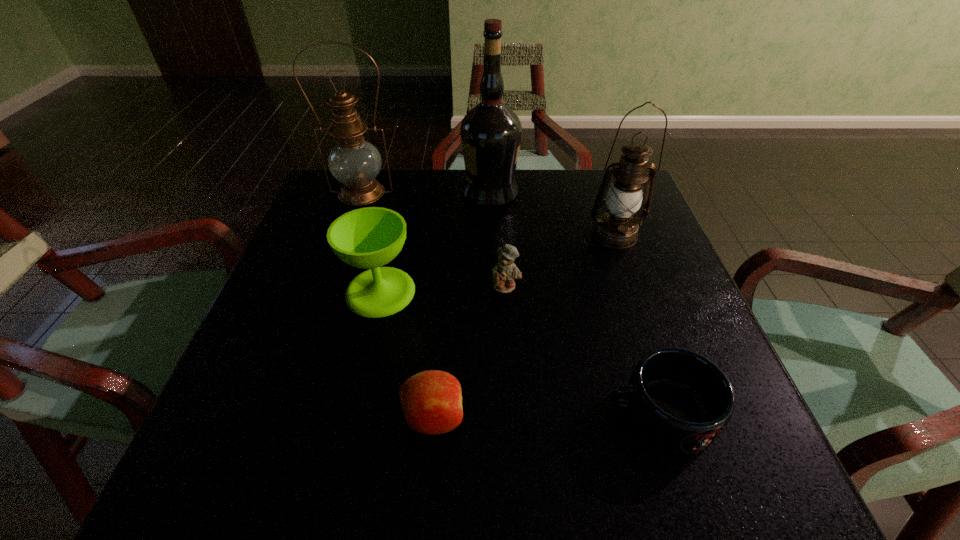
In order to click on free space between the third tallest object and the farther oil lamp in this screenshot , I will do `click(489, 214)`.

The height and width of the screenshot is (540, 960). I want to click on object that stands as the sixth closest to the third tallest object, so click(353, 161).

Point out which object is positioned as the third nearest to the teddy bear. Please provide its 2D coordinates. Your answer should be formatted as a tuple, i.e. [(x, y)], where the tuple contains the x and y coordinates of a point satisfying the conditions above.

[(679, 401)]

Image resolution: width=960 pixels, height=540 pixels. I want to click on vacant point that satisfies the following two spatial constraints: 1. on the surface of the liquor; 2. on the left side of the right oil lamp, so click(492, 234).